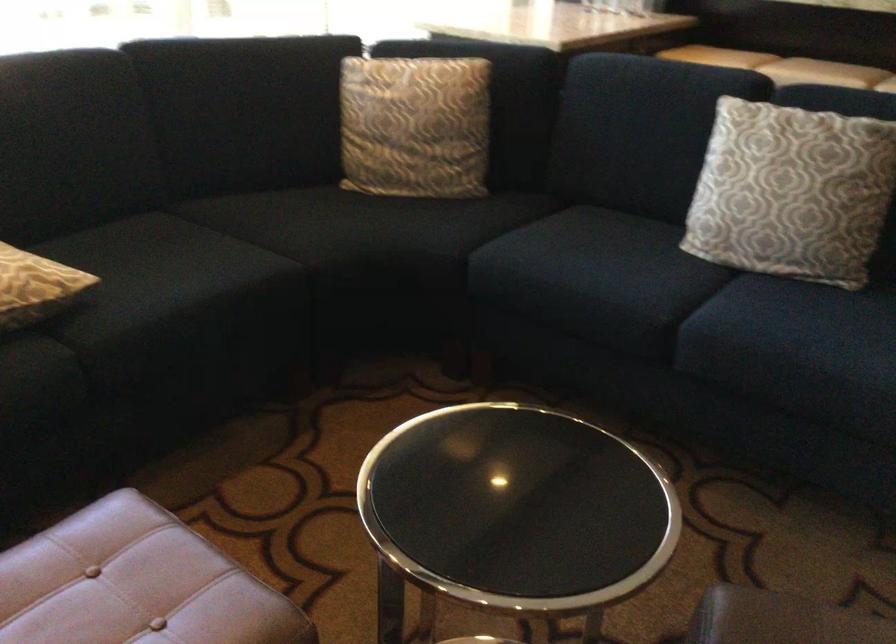
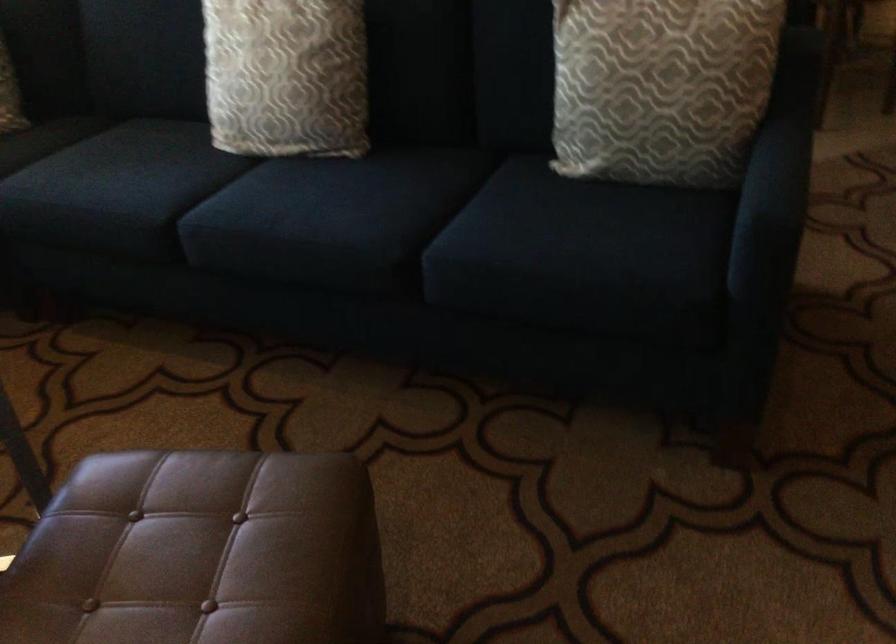
Question: Which direction would the cameraman need to move to produce the second image? Reply with the corresponding letter.

Choices:
 (A) Left
 (B) Right
 (C) Forward
 (D) Backward

Answer: (B)